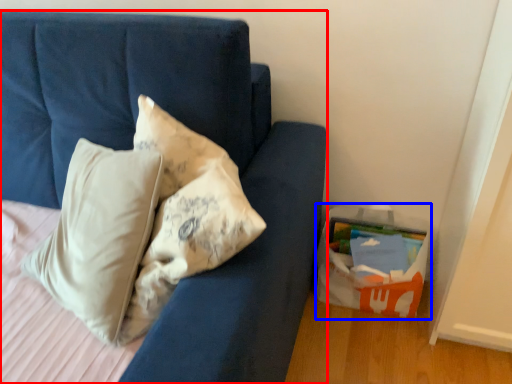
Question: Which object is closer to the camera taking this photo, furniture (highlighted by a red box) or cardboard box (highlighted by a blue box)?

Choices:
 (A) furniture
 (B) cardboard box

Answer: (A)